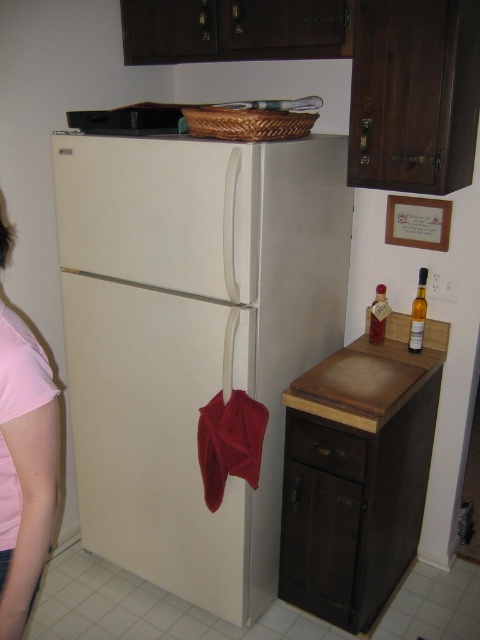
Looking at this image, you are trying to reach the yellow glass bottle at right on the countertop but there is a brown wood drawer at lower center in the way. Can you move the drawer to the side to access the bottle?

The brown wood drawer at lower center is shorter than the yellow glass bottle at right, so you can move the drawer to the side to access the bottle since its height is less than the bottle.

You are organizing a drawer and need to place the pink fabric shirt at left and the yellow glass bottle at right. Which item requires more space in the drawer?

The pink fabric shirt at left requires more space in the drawer because it is bigger than the yellow glass bottle at right.

You are in a kitchen and need to place a small plant between the two points labeled point (x=322, y=164) and point (x=372, y=317). Which point should the plant be closer to?

The plant should be closer to point (x=322, y=164) because it is in front of point (x=372, y=317).